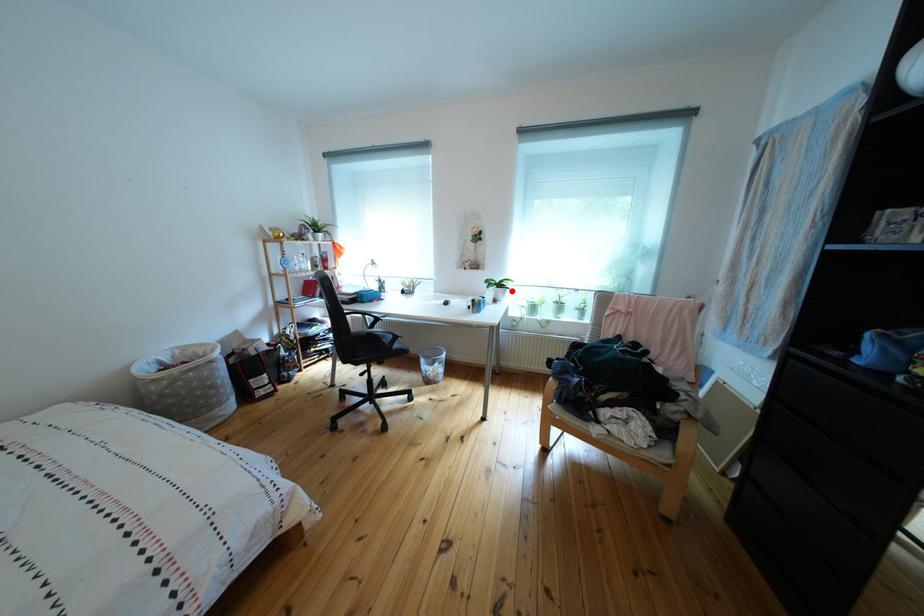
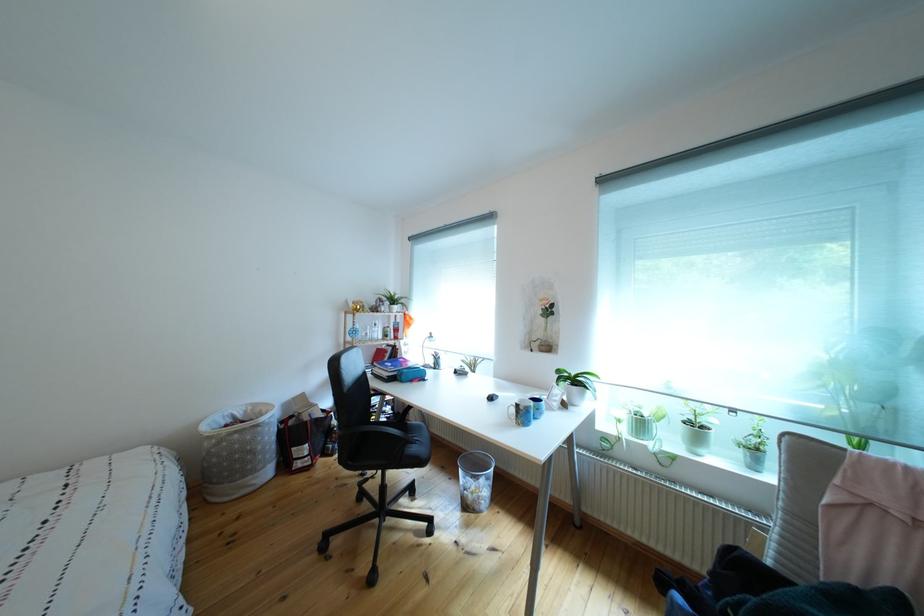
Question: I am providing you with two images of the same scene from different viewpoints. Given a red point in image1, look at the same physical point in image2. Is it:

Choices:
 (A) Closer to the viewpoint
 (B) Farther from the viewpoint

Answer: (B)